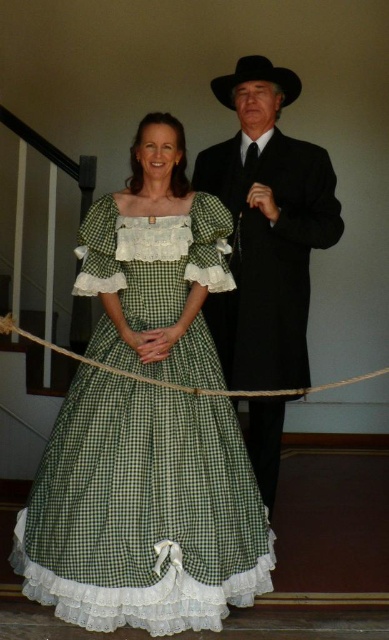
Question: Which point appears farthest from the camera in this image?

Choices:
 (A) (264, 113)
 (B) (234, 74)
 (C) (99, 524)

Answer: (B)

Question: Which object is the farthest from the black felt cowboy hat at upper center?

Choices:
 (A) matte black suit at center
 (B) green checkered dress at center

Answer: (B)

Question: From the image, what is the correct spatial relationship of green checkered dress at center in relation to matte black suit at center?

Choices:
 (A) above
 (B) below

Answer: (B)

Question: Can you confirm if green checkered dress at center is thinner than matte black suit at center?

Choices:
 (A) no
 (B) yes

Answer: (A)

Question: Where is green checkered dress at center located in relation to black felt cowboy hat at upper center in the image?

Choices:
 (A) left
 (B) right

Answer: (A)

Question: Which point is closer to the camera taking this photo?

Choices:
 (A) (229, 97)
 (B) (252, 538)

Answer: (B)